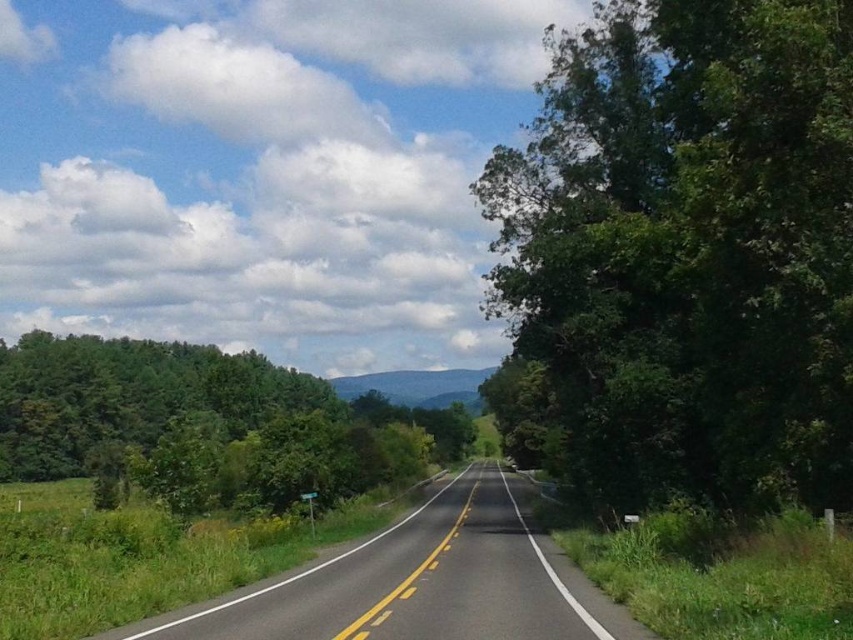
Looking at this image, you are driving a car that is 2 meters wide. You see the green leafy tree at right and the asphalt road at center. Can your car fit between them without touching either?

The green leafy tree at right has a lesser width compared to asphalt road at center. Therefore, the distance between them is wider than the tree, so the car can fit.

You are standing on the rural road and want to reach a specific point marked at coordinates point (x=584, y=230). If your walking speed is 1.5 meters per second, how many seconds will it take you to reach that point?

The distance between you and point (x=584, y=230) is 22.38 meters. At a walking speed of 1.5 meters per second, it will take approximately 14.92 seconds to reach the point.

You are a hiker standing on the rural road and want to take a photo of the green leafy tree at right and green leafy tree at left. Which tree should you focus on to capture the most detailed image?

The green leafy tree at right should be focused on since it has a greater height compared to the green leafy tree at left, making it more prominent in the photo.